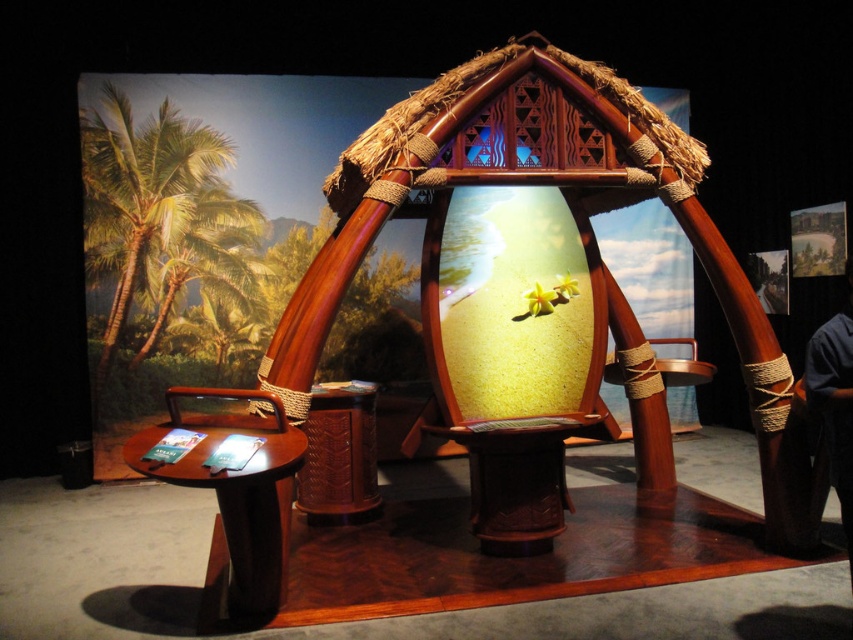
Question: Which point is farther from the camera taking this photo?

Choices:
 (A) (849, 570)
 (B) (223, 186)

Answer: (B)

Question: Considering the relative positions of green leafy palm tree at left and dark blue shirt at right in the image provided, where is green leafy palm tree at left located with respect to dark blue shirt at right?

Choices:
 (A) below
 (B) above

Answer: (B)

Question: Which of the following is the farthest from the observer?

Choices:
 (A) dark blue shirt at right
 (B) green leafy palm tree at left

Answer: (B)

Question: Is green leafy palm tree at left further to the viewer compared to dark blue shirt at right?

Choices:
 (A) yes
 (B) no

Answer: (A)

Question: Does green leafy palm tree at left have a larger size compared to dark blue shirt at right?

Choices:
 (A) no
 (B) yes

Answer: (B)